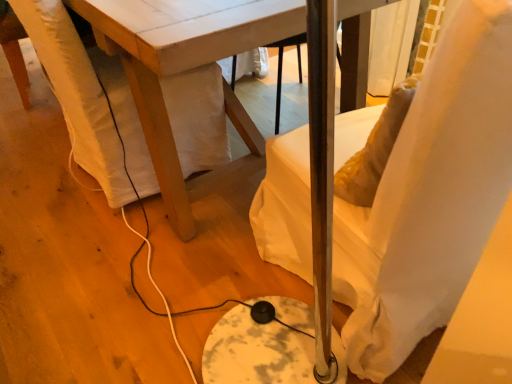
Question: Does white fabric swivel chair at lower left have a lesser height compared to white fabric chair at right?

Choices:
 (A) yes
 (B) no

Answer: (A)

Question: Does white fabric swivel chair at lower left have a lesser width compared to white fabric chair at right?

Choices:
 (A) no
 (B) yes

Answer: (B)

Question: Is white fabric swivel chair at lower left surrounding white fabric chair at right?

Choices:
 (A) yes
 (B) no

Answer: (B)

Question: Is the depth of white fabric swivel chair at lower left less than that of white fabric chair at right?

Choices:
 (A) yes
 (B) no

Answer: (B)

Question: Is white fabric swivel chair at lower left outside white fabric chair at right?

Choices:
 (A) yes
 (B) no

Answer: (A)

Question: Is white fabric chair at right wider or thinner than white fabric swivel chair at lower left?

Choices:
 (A) wide
 (B) thin

Answer: (A)

Question: From their relative heights in the image, would you say white fabric chair at right is taller or shorter than white fabric swivel chair at lower left?

Choices:
 (A) short
 (B) tall

Answer: (B)

Question: Considering the positions of point (451, 195) and point (219, 91), is point (451, 195) closer or farther from the camera than point (219, 91)?

Choices:
 (A) closer
 (B) farther

Answer: (A)

Question: Based on their sizes in the image, would you say white fabric chair at right is bigger or smaller than white fabric swivel chair at lower left?

Choices:
 (A) big
 (B) small

Answer: (A)

Question: From the image's perspective, relative to white fabric chair at right, is white fabric swivel chair at lower left above or below?

Choices:
 (A) below
 (B) above

Answer: (B)

Question: Visually, is white fabric swivel chair at lower left positioned to the left or to the right of white fabric chair at right?

Choices:
 (A) left
 (B) right

Answer: (A)

Question: From a real-world perspective, is white fabric swivel chair at lower left positioned above or below white fabric chair at right?

Choices:
 (A) above
 (B) below

Answer: (B)

Question: Is white fabric swivel chair at lower left inside the boundaries of white fabric chair at right, or outside?

Choices:
 (A) inside
 (B) outside

Answer: (B)

Question: Choose the correct answer: Is white fabric swivel chair at lower left inside white wood table at center or outside it?

Choices:
 (A) outside
 (B) inside

Answer: (B)

Question: In terms of height, does white fabric swivel chair at lower left look taller or shorter compared to white wood table at center?

Choices:
 (A) tall
 (B) short

Answer: (B)